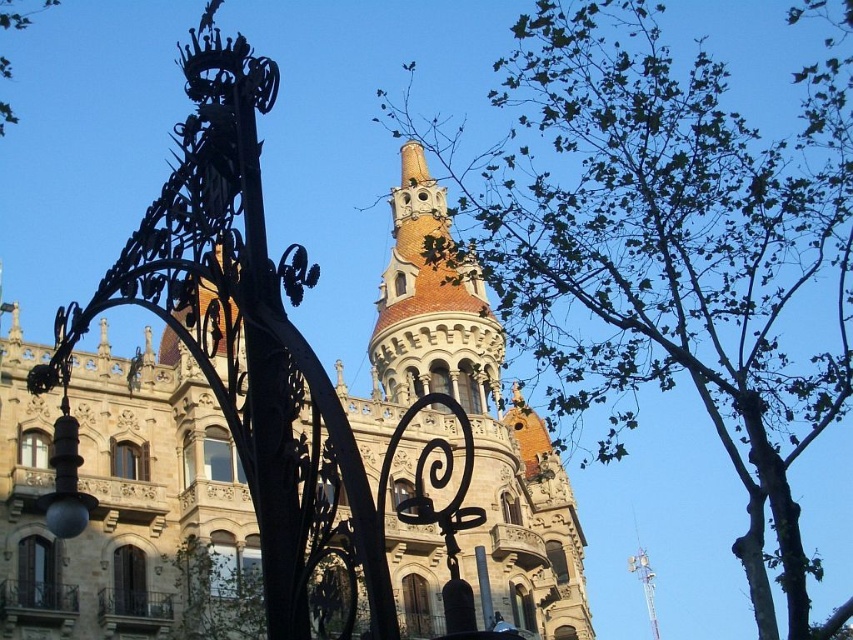
Question: Which object is farther from the camera taking this photo?

Choices:
 (A) green leafy tree at upper left
 (B) green leafy tree at upper right
 (C) terracotta ceramic tower at center

Answer: (C)

Question: Can you confirm if terracotta ceramic tower at center is positioned to the left of green leafy tree at upper left?

Choices:
 (A) yes
 (B) no

Answer: (B)

Question: Which point appears closest to the camera in this image?

Choices:
 (A) (614, 196)
 (B) (386, 324)

Answer: (B)

Question: Which point appears closest to the camera in this image?

Choices:
 (A) (12, 120)
 (B) (787, 372)

Answer: (A)

Question: Considering the relative positions of green leafy tree at upper right and green leafy tree at upper left in the image provided, where is green leafy tree at upper right located with respect to green leafy tree at upper left?

Choices:
 (A) above
 (B) below

Answer: (B)

Question: Is green leafy tree at upper right thinner than green leafy tree at upper left?

Choices:
 (A) yes
 (B) no

Answer: (B)